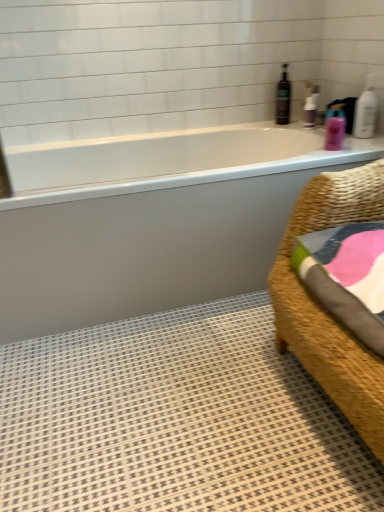
At what (x,y) coordinates should I click in order to perform the action: click on free space to the left of brown glass bottle at upper right. Please return your answer as a coordinate pair (x, y). This screenshot has width=384, height=512. Looking at the image, I should click on coord(253,124).